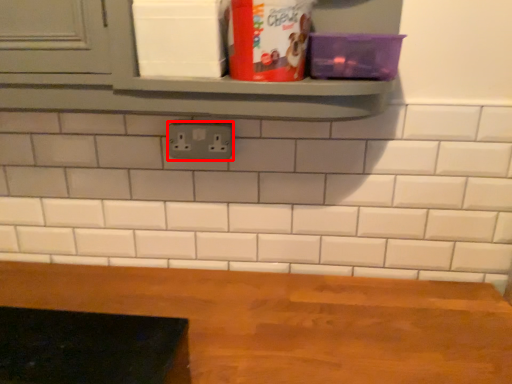
Question: From the image's perspective, where is electric outlet (annotated by the red box) located relative to table?

Choices:
 (A) below
 (B) above

Answer: (B)